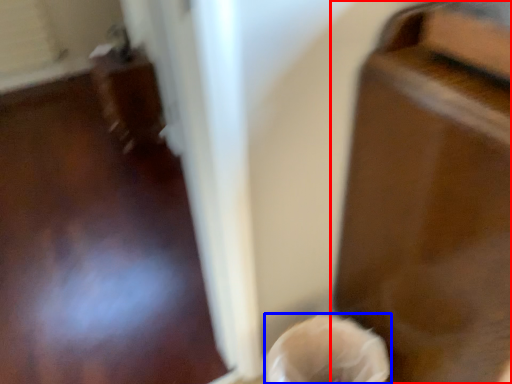
Question: Which object appears farthest to the camera in this image, furniture (highlighted by a red box) or woman (highlighted by a blue box)?

Choices:
 (A) furniture
 (B) woman

Answer: (B)